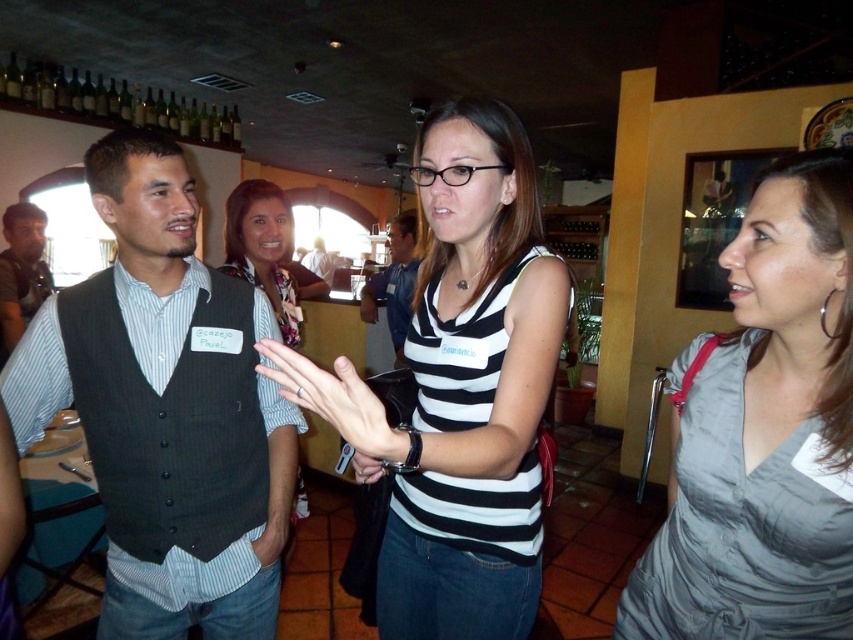
Question: Is black and white striped tank top at center closer to the viewer compared to matte black vest at left?

Choices:
 (A) no
 (B) yes

Answer: (B)

Question: Which of the following is the closest to the observer?

Choices:
 (A) gray satin dress at center
 (B) matte black vest at left
 (C) dark gray pinstripe vest at left

Answer: (A)

Question: Which of these objects is positioned farthest from the black and white striped tank top at center?

Choices:
 (A) dark gray pinstripe vest at left
 (B) matte black vest at left
 (C) gray satin dress at center

Answer: (B)

Question: Is dark gray pinstripe vest at left wider than matte black vest at left?

Choices:
 (A) yes
 (B) no

Answer: (A)

Question: Which point is closer to the camera taking this photo?

Choices:
 (A) (764, 602)
 (B) (445, 420)
 (C) (169, 387)
 (D) (408, 246)

Answer: (A)

Question: Is black and white striped tank top at center wider than matte black vest at center?

Choices:
 (A) no
 (B) yes

Answer: (B)